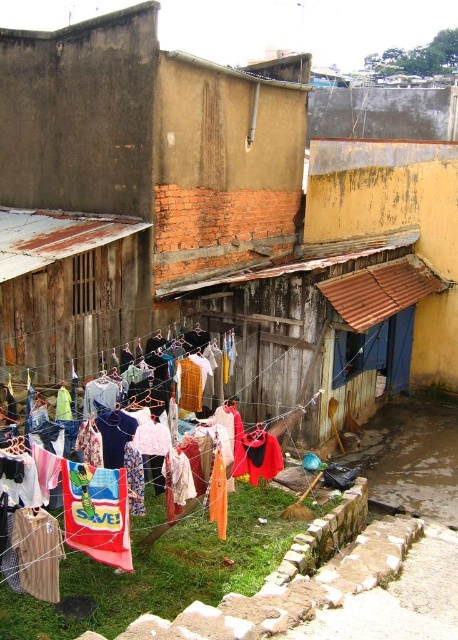
Question: Does wooden clothesline at lower left have a smaller size compared to red fabric banner at center?

Choices:
 (A) yes
 (B) no

Answer: (B)

Question: Which object appears farthest from the camera in this image?

Choices:
 (A) red fabric towel at center
 (B) red fabric banner at center

Answer: (B)

Question: Does red fabric banner at center appear under red fabric towel at center?

Choices:
 (A) no
 (B) yes

Answer: (A)

Question: Estimate the real-world distances between objects in this image. Which object is closer to the red fabric banner at center?

Choices:
 (A) red fabric towel at center
 (B) multicolored fabric at center
 (C) red fabric cloth at center

Answer: (A)

Question: Does wooden clothesline at lower left appear under multicolored fabric at center?

Choices:
 (A) yes
 (B) no

Answer: (B)

Question: Among these objects, which one is nearest to the camera?

Choices:
 (A) red fabric towel at center
 (B) red fabric cloth at center
 (C) wooden clothesline at lower left

Answer: (A)